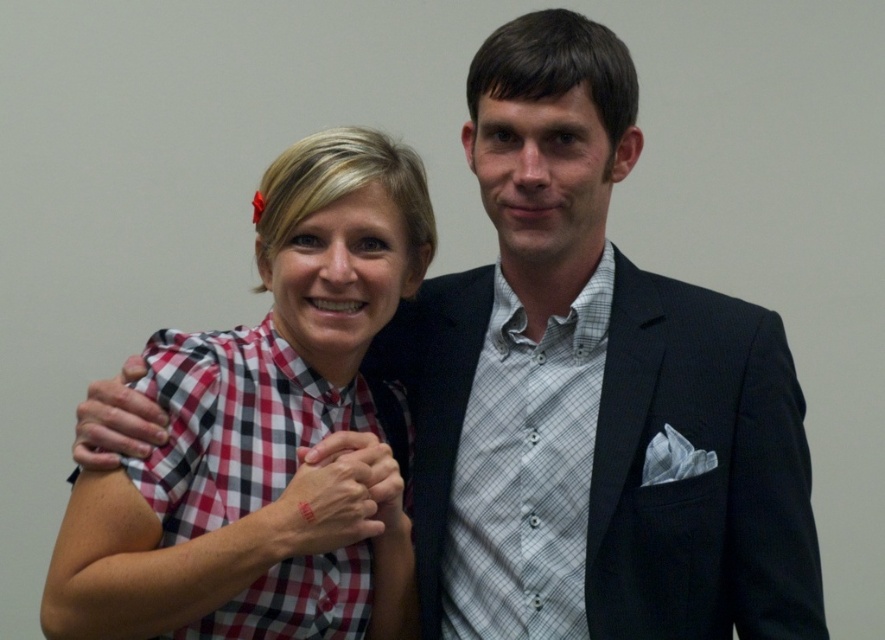
You are a photographer setting up for a group photo. You notice two shirts in the scene, the checkered fabric shirt at center and the matte red plaid shirt at upper left. Which shirt is located to the right of the other?

The checkered fabric shirt at center is positioned on the right side of matte red plaid shirt at upper left.

You are a photographer standing 1 meter away from the checkered fabric shirt at center. Can you reach it without moving your feet?

The checkered fabric shirt at center is 1.11 meters away from you, so you cannot reach it without moving your feet since it is slightly farther than your current distance of 1 meter.

You are standing at the point marked by the coordinates point (x=245, y=428). You want to walk to the nearest exit, which is located behind the woman with short blonde hair in the image. Can you walk directly towards the exit without moving past the man in the dark suit?

The point (x=245, y=428) and viewer are 4.07 feet apart. Since the exit is behind the woman with short blonde hair, you would need to move past the man in the dark suit to reach it, so you cannot walk directly towards the exit without moving past the man in the dark suit.